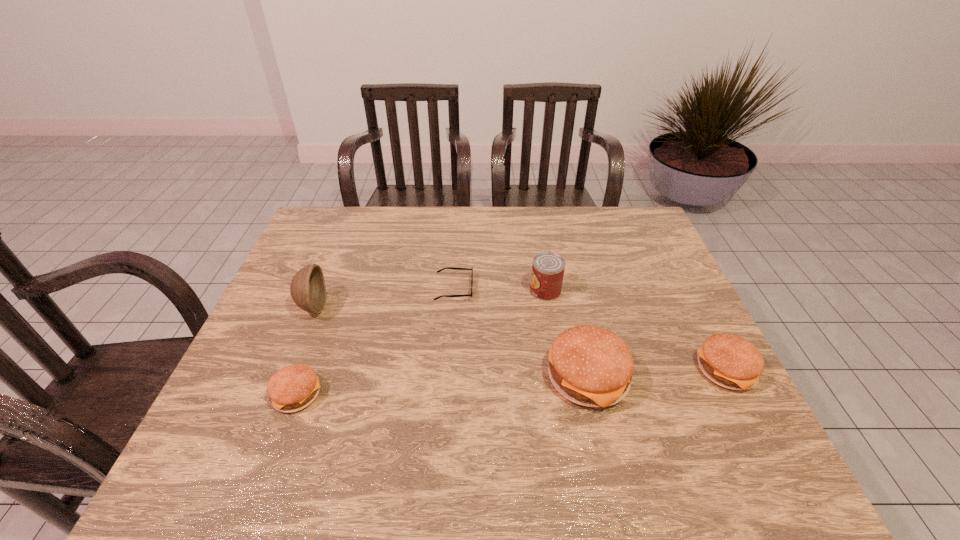
Find the location of a particular element. The width and height of the screenshot is (960, 540). vacant position for inserting another hamburger evenly is located at coordinates (444, 386).